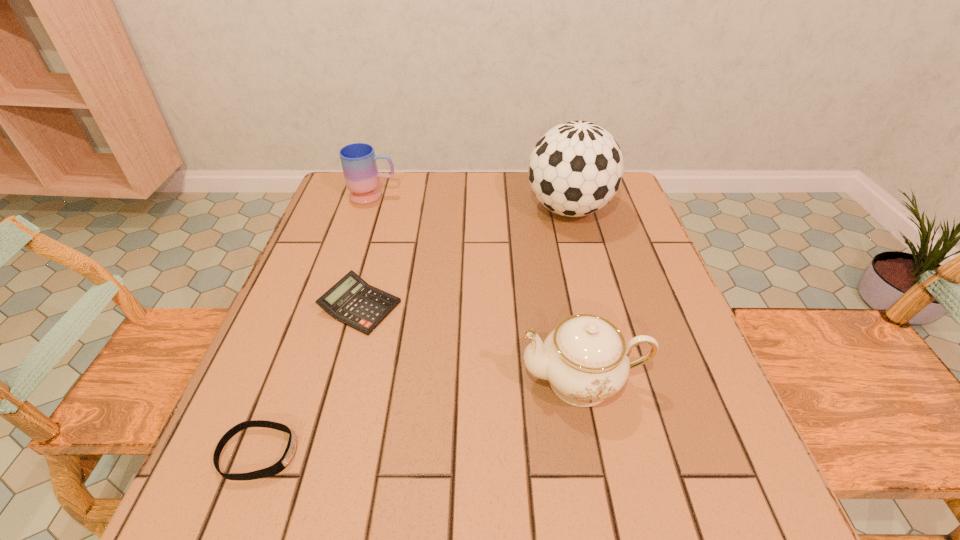
The height and width of the screenshot is (540, 960). In order to click on vacant area located 0.240m at the spout of the chinaware in this screenshot , I will do `click(389, 381)`.

The width and height of the screenshot is (960, 540). Identify the location of vacant area situated on the side of the mug with the handle. (506, 195).

This screenshot has width=960, height=540. In order to click on vacant space located on the front of the second shortest object in this screenshot , I will do `click(316, 470)`.

Find the location of a particular element. Image resolution: width=960 pixels, height=540 pixels. vacant point located on the display of the nearest object is located at coordinates (482, 453).

Identify the location of soccer ball that is at the far edge. (576, 168).

Find the location of a particular element. The width and height of the screenshot is (960, 540). mug at the far edge is located at coordinates (358, 160).

Where is `object located at the near edge`? The image size is (960, 540). object located at the near edge is located at coordinates (289, 452).

At what (x,y) coordinates should I click in order to perform the action: click on mug at the left edge. Please return your answer as a coordinate pair (x, y). The width and height of the screenshot is (960, 540). Looking at the image, I should click on (358, 160).

This screenshot has height=540, width=960. I want to click on calculator at the left edge, so click(x=352, y=301).

Where is `wristband that is at the left edge`? The height and width of the screenshot is (540, 960). wristband that is at the left edge is located at coordinates (289, 452).